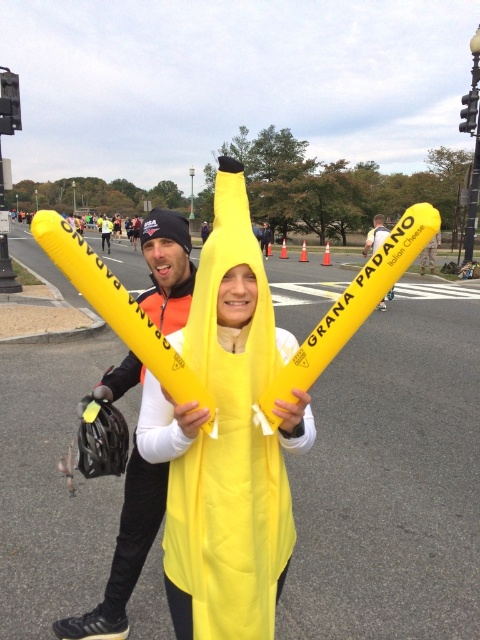
Based on the photo, is matte yellow baton at center in front of yellow matte balloon at center?

No, it is behind yellow matte balloon at center.

Where is `matte yellow baton at center`? This screenshot has height=640, width=480. matte yellow baton at center is located at coordinates (124, 552).

Between point (271, 435) and point (365, 250), which one is positioned in front?

Point (271, 435) is in front.

Locate an element on the screen. Image resolution: width=480 pixels, height=640 pixels. yellow fabric banana at center is located at coordinates (229, 442).

Find the location of `yellow fabric banana at center`. yellow fabric banana at center is located at coordinates (229, 442).

Between yellow fabric banana at center and matte yellow baton at center, which one has less height?

matte yellow baton at center is shorter.

Does yellow fabric banana at center have a smaller size compared to matte yellow baton at center?

No.

Locate an element on the screen. yellow fabric banana at center is located at coordinates (229, 442).

In order to click on yellow fabric banana at center in this screenshot , I will do `click(229, 442)`.